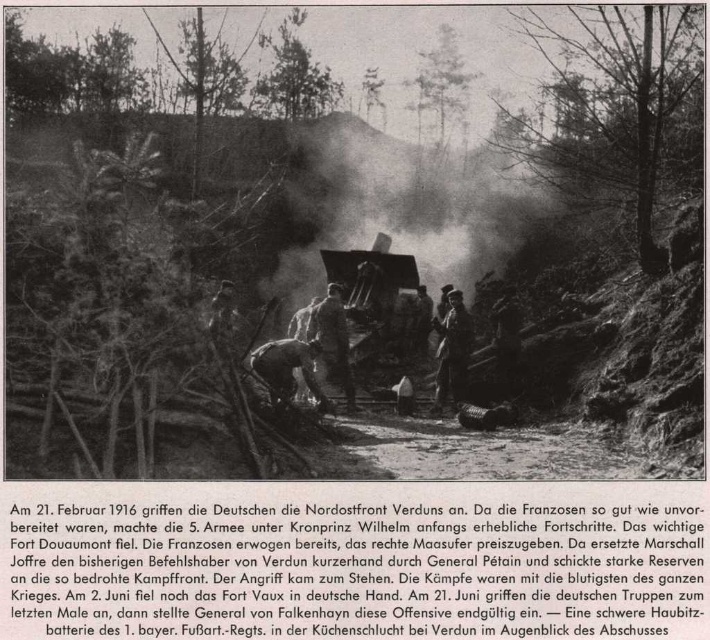
Does dark brown leather helmet at center come in front of dark gray uniform at center?

Yes, dark brown leather helmet at center is closer to the viewer.

The height and width of the screenshot is (640, 710). What do you see at coordinates (288, 369) in the screenshot? I see `dark brown leather helmet at center` at bounding box center [288, 369].

The width and height of the screenshot is (710, 640). I want to click on dark brown leather helmet at center, so click(x=288, y=369).

This screenshot has width=710, height=640. What are the coordinates of `dark brown leather helmet at center` in the screenshot? It's located at (288, 369).

Between smoketransparentatcenter and dark brown leather helmet at center, which one appears on the left side from the viewer's perspective?

dark brown leather helmet at center is more to the left.

Between smoketransparentatcenter and dark brown leather helmet at center, which one has more height?

Standing taller between the two is smoketransparentatcenter.

What do you see at coordinates (404, 204) in the screenshot? I see `smoketransparentatcenter` at bounding box center [404, 204].

Identify the location of smoketransparentatcenter. (404, 204).

Can you confirm if smoketransparentatcenter is positioned above dark gray uniform at center?

Yes, smoketransparentatcenter is above dark gray uniform at center.

Which of these two, smoketransparentatcenter or dark gray uniform at center, stands taller?

smoketransparentatcenter

Where is `smoketransparentatcenter`? smoketransparentatcenter is located at coordinates (404, 204).